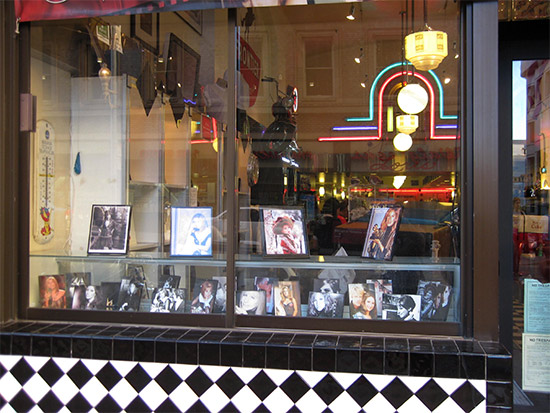
I want to click on window, so click(386, 244).